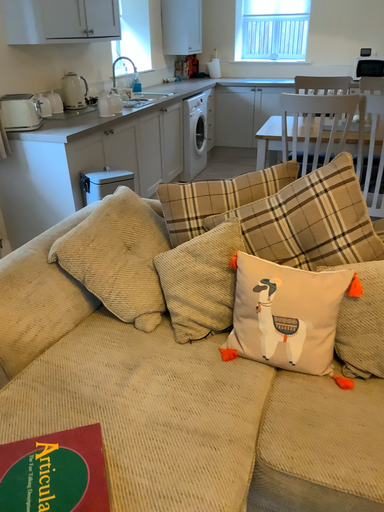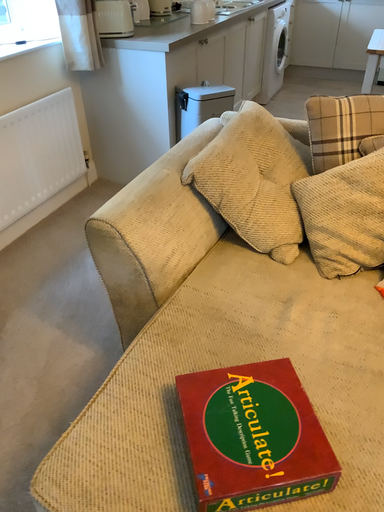
Question: Which way did the camera rotate in the video?

Choices:
 (A) rotated upward
 (B) rotated downward

Answer: (B)